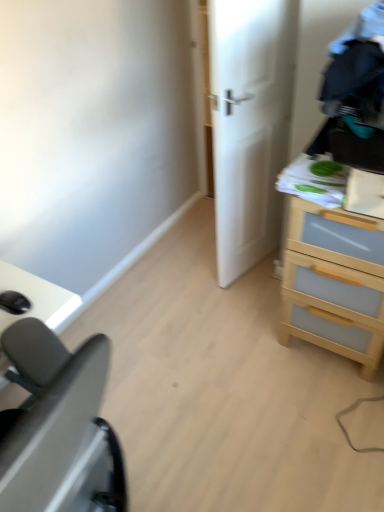
Locate an element on the screen. free location to the right of black matte desk at lower left is located at coordinates (165, 420).